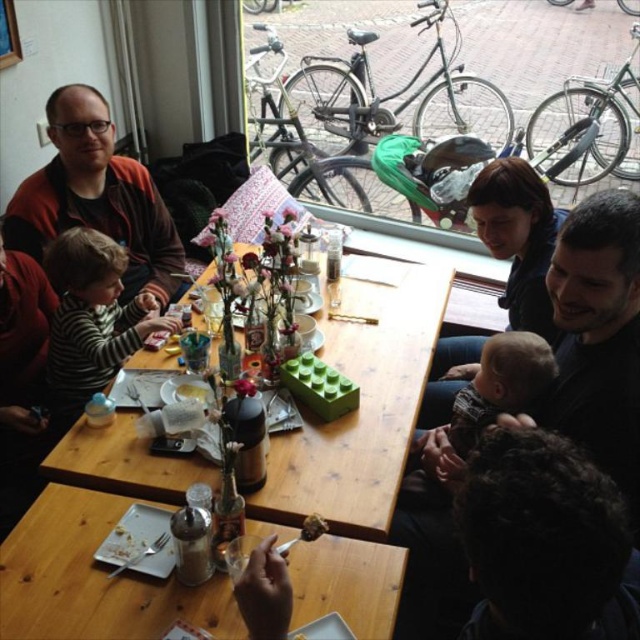
You are a customer sitting at the wooden table at center and want to grab your matte red sweater at upper left before leaving. Can you reach it without moving from your seat?

The wooden table at center is positioned on the right side of matte red sweater at upper left, meaning the sweater is to your left. Since you are sitting at the table, you can likely reach the sweater at your left side without needing to move from your seat.

Looking at this image, you are standing at the entrance of the cafe and want to place a new table exactly at the point labeled as point (x=364, y=458). Considering the existing tables and the space available, will the table fit comfortably without being too close to the entrance? Please provide your reasoning based on the distance from the camera.

The distance of point (x=364, y=458) from the camera is 4.99 feet. Since the point is 5 feet away from the entrance, placing a table there would leave enough space for people to move comfortably without being too close to the entrance.

You are a server at the cafe and need to place a 10 cm tall drink on the table. The striped cotton shirt at left is currently on the table. Can the drink be placed on the wooden table at center without touching the shirt?

The wooden table at center has a greater height compared to striped cotton shirt at left, so the drink can be placed on the wooden table at center without touching the shirt as long as there is enough space between them.